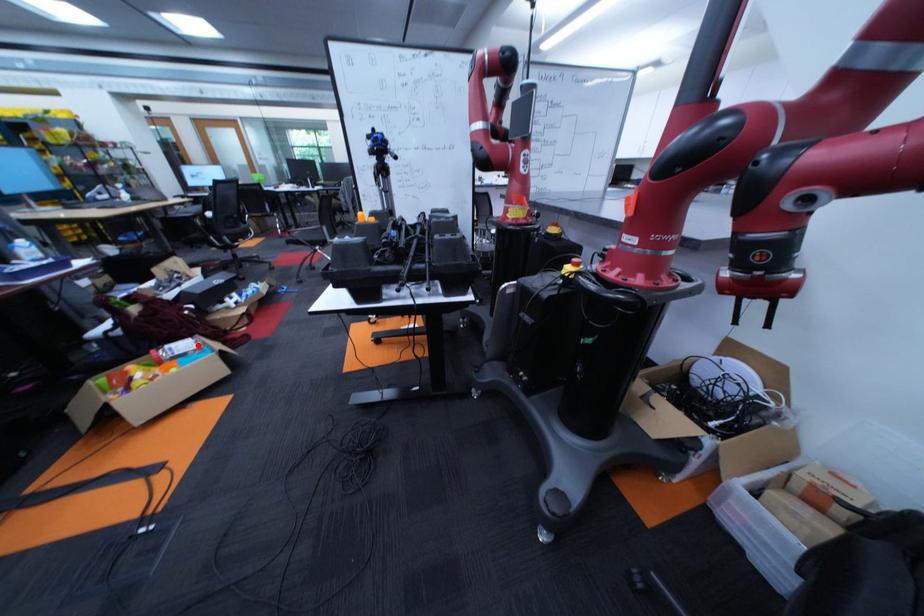
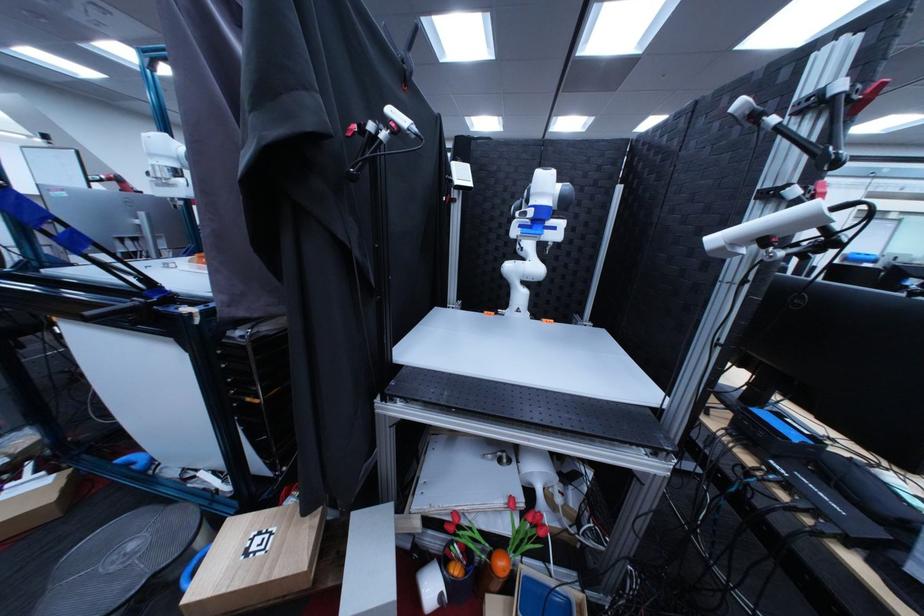
Question: I am providing you with two images of the same scene from different viewpoints. A red point is marked on the first image. At the location where the point appears in image 1, is it still visible in image 2?

Choices:
 (A) Yes
 (B) No

Answer: (B)